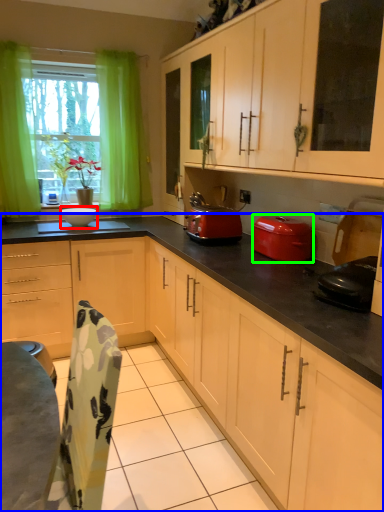
Question: Which is farther away from appliance (highlighted by a red box)? cabinetry (highlighted by a blue box) or kitchen appliance (highlighted by a green box)?

Choices:
 (A) cabinetry
 (B) kitchen appliance

Answer: (A)